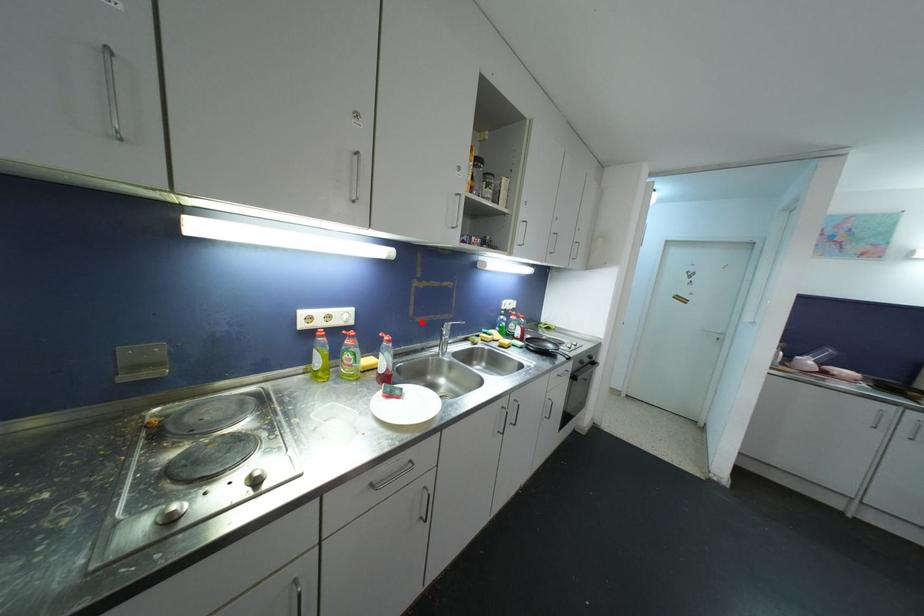
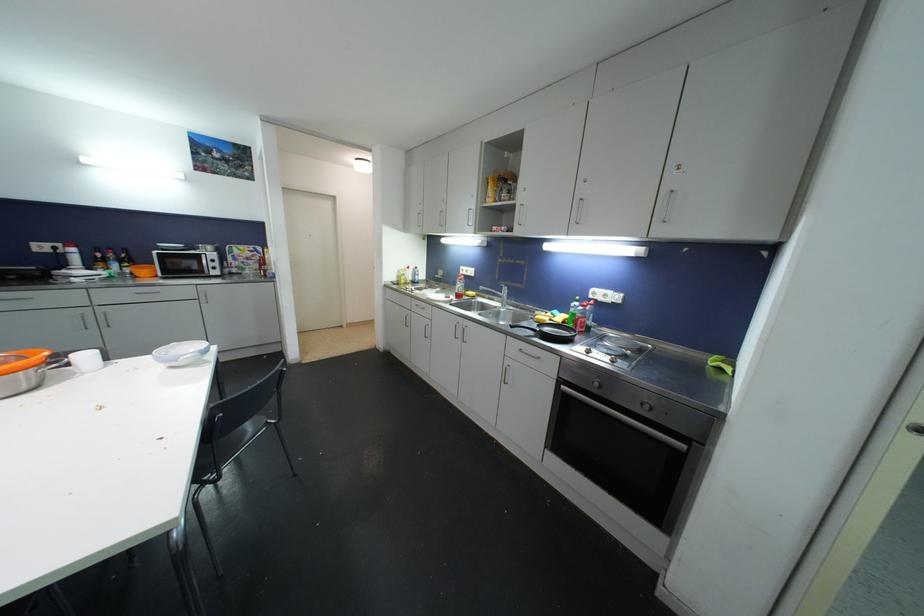
Question: I am providing you with two images of the same scene from different viewpoints. A red point is marked on the first image. Can you still see the location of the red point in image 2?

Choices:
 (A) Yes
 (B) No

Answer: (A)